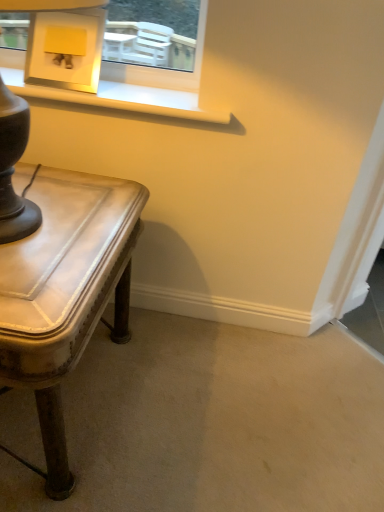
Question: Is matte brown table lamp at left in front of or behind leather-like table at lower left in the image?

Choices:
 (A) front
 (B) behind

Answer: (A)

Question: Is matte brown table lamp at left wider or thinner than leather-like table at lower left?

Choices:
 (A) thin
 (B) wide

Answer: (A)

Question: Visually, is matte brown table lamp at left positioned to the left or to the right of leather-like table at lower left?

Choices:
 (A) right
 (B) left

Answer: (A)

Question: In the image, is leather-like table at lower left on the left side or the right side of matte brown table lamp at left?

Choices:
 (A) right
 (B) left

Answer: (B)

Question: From a real-world perspective, is leather-like table at lower left above or below matte brown table lamp at left?

Choices:
 (A) above
 (B) below

Answer: (B)

Question: Is leather-like table at lower left inside the boundaries of matte brown table lamp at left, or outside?

Choices:
 (A) outside
 (B) inside

Answer: (A)

Question: Based on their sizes in the image, would you say leather-like table at lower left is bigger or smaller than matte brown table lamp at left?

Choices:
 (A) small
 (B) big

Answer: (B)